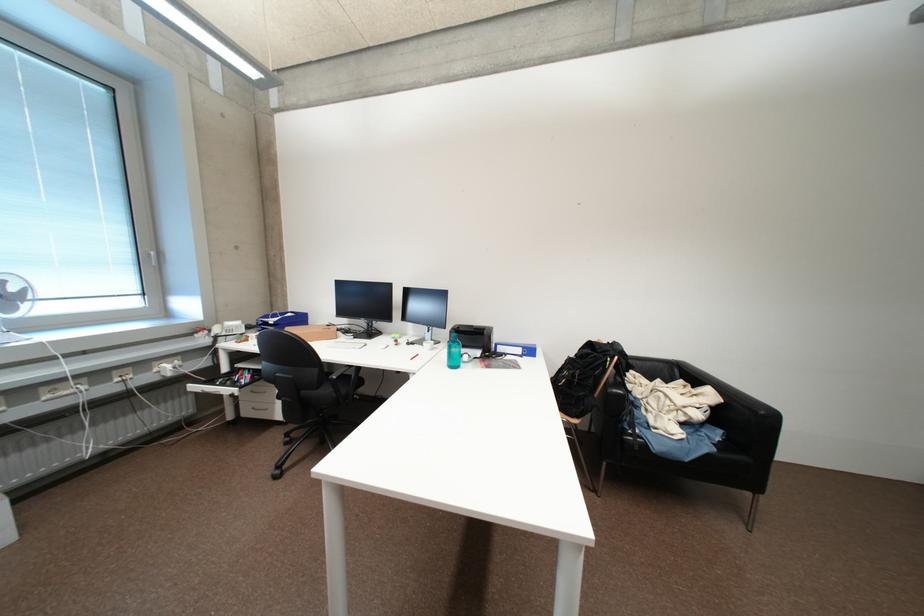
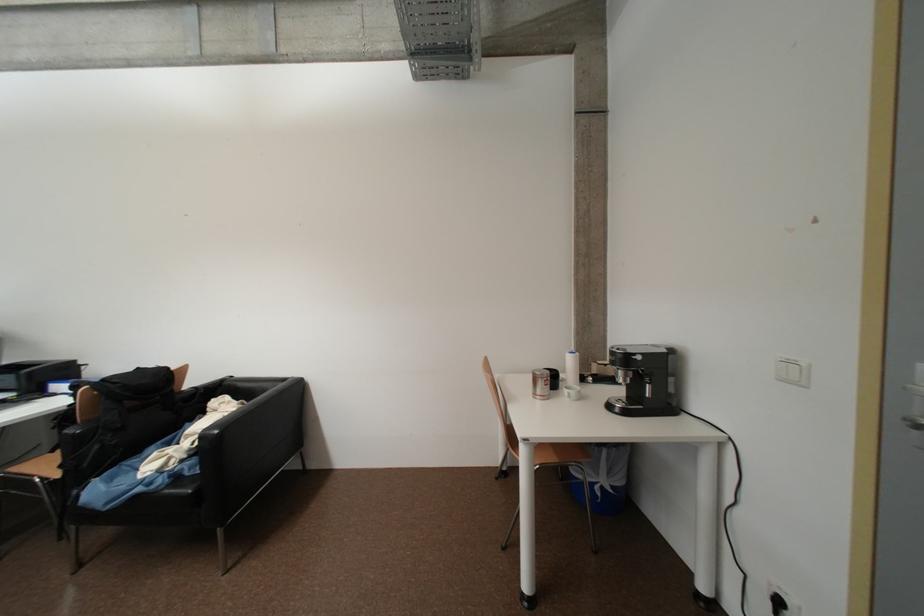
Question: The images are taken continuously from a first-person perspective. In which direction are you moving?

Choices:
 (A) Left
 (B) Right
 (C) Forward
 (D) Backward

Answer: (B)